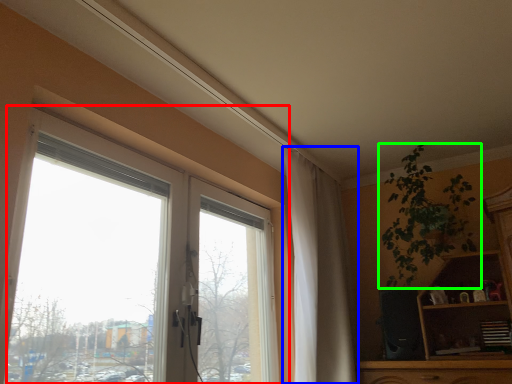
Question: Estimate the real-world distances between objects in this image. Which object is farther from window (highlighted by a red box), curtain (highlighted by a blue box) or houseplant (highlighted by a green box)?

Choices:
 (A) curtain
 (B) houseplant

Answer: (B)